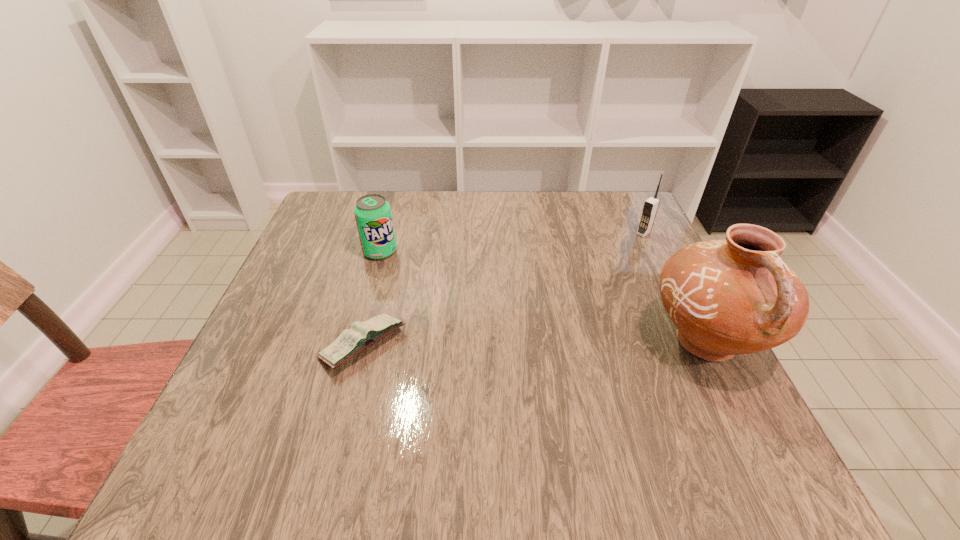
Identify the location of free space between the second shortest object and the farthest object. This screenshot has width=960, height=540. (512, 242).

Locate which object is the third closest to the pop soda. Please provide its 2D coordinates. Your answer should be formatted as a tuple, i.e. [(x, y)], where the tuple contains the x and y coordinates of a point satisfying the conditions above.

[(651, 205)]

Locate an element on the screen. object identified as the third closest to the tallest object is located at coordinates (372, 212).

Image resolution: width=960 pixels, height=540 pixels. I want to click on blank space that satisfies the following two spatial constraints: 1. on the back side of the second farthest object; 2. on the left side of the farthest object, so click(385, 233).